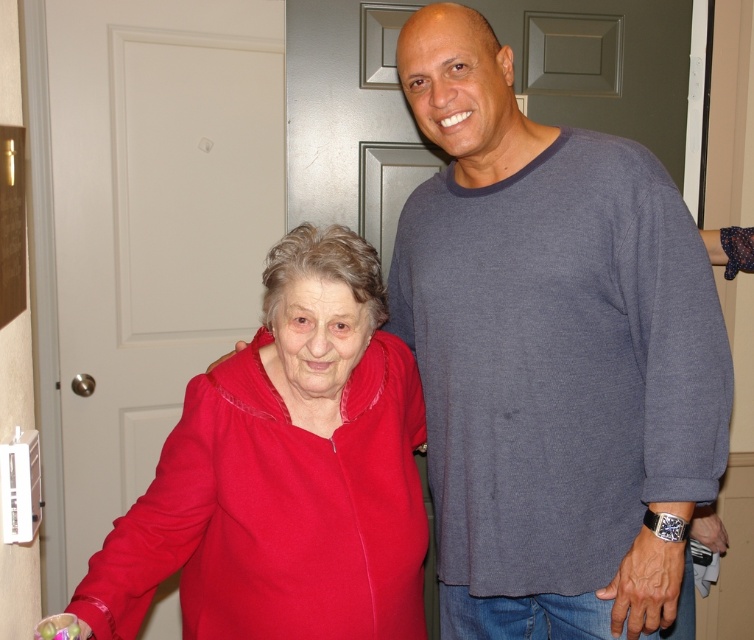
Question: Is gray cotton shirt at right wider than matte red sweater at left?

Choices:
 (A) no
 (B) yes

Answer: (B)

Question: Which point is closer to the camera?

Choices:
 (A) gray cotton shirt at right
 (B) matte red sweater at left

Answer: (B)

Question: Which point appears farthest from the camera in this image?

Choices:
 (A) click(449, 332)
 (B) click(204, 580)

Answer: (A)

Question: Can you confirm if gray cotton shirt at right is positioned to the right of matte red sweater at left?

Choices:
 (A) yes
 (B) no

Answer: (A)

Question: Is gray cotton shirt at right thinner than matte red sweater at left?

Choices:
 (A) yes
 (B) no

Answer: (B)